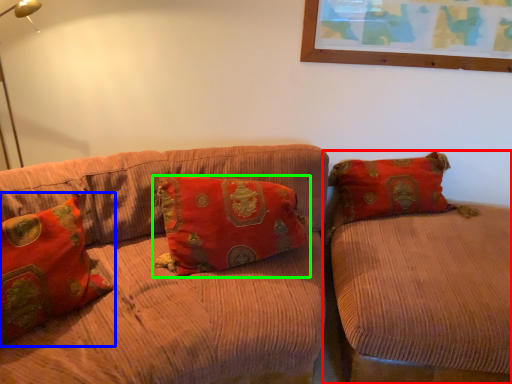
Question: Considering the real-world distances, which object is closest to studio couch (highlighted by a red box)? pillow (highlighted by a blue box) or pillow (highlighted by a green box).

Choices:
 (A) pillow
 (B) pillow

Answer: (B)